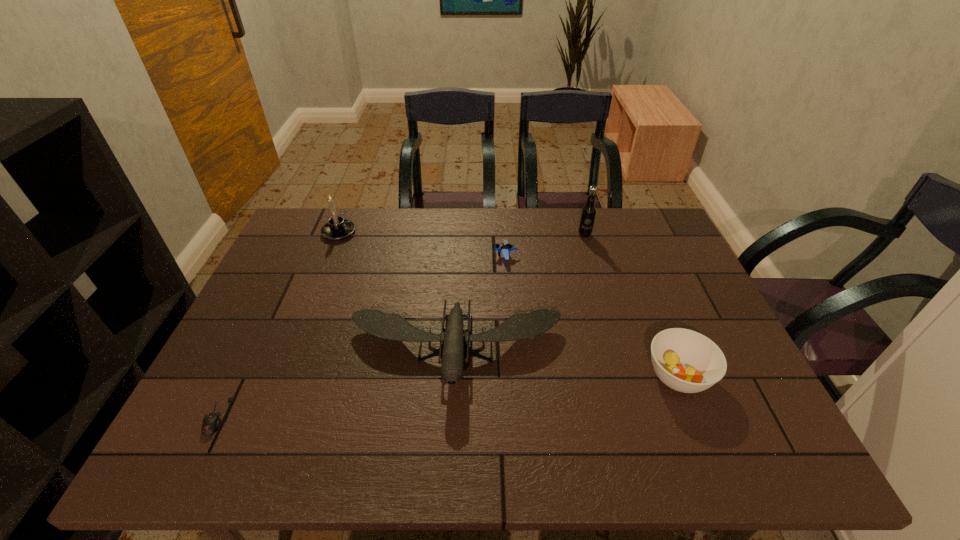
Identify the location of the leftmost object. (211, 422).

Where is `vacant space located on the label of the root beer`? This screenshot has height=540, width=960. vacant space located on the label of the root beer is located at coordinates (605, 302).

The width and height of the screenshot is (960, 540). I want to click on vacant space located 0.380m with a handle on the side of the second tallest object, so click(x=470, y=232).

The width and height of the screenshot is (960, 540). Identify the location of blank space located at the head of the fourth shortest object. (452, 424).

The image size is (960, 540). I want to click on blank area located 0.300m on the left of the fourth tallest object, so click(x=516, y=376).

In order to click on blank space located 0.250m on the front-facing side of the Lego in this screenshot , I will do `click(413, 256)`.

This screenshot has width=960, height=540. I want to click on free space located on the front-facing side of the Lego, so [435, 256].

You are a GUI agent. You are given a task and a screenshot of the screen. Output one action in this format:
    pyautogui.click(x=<x>, y=<y>)
    Task: Click on the vacant position located on the front-facing side of the Lego
    This screenshot has height=540, width=960.
    Given the screenshot: What is the action you would take?
    pyautogui.click(x=368, y=256)

In order to click on vacant space located 0.070m on the back of the shortest object in this screenshot , I will do `click(241, 372)`.

Image resolution: width=960 pixels, height=540 pixels. I want to click on root beer that is at the far edge, so tap(588, 213).